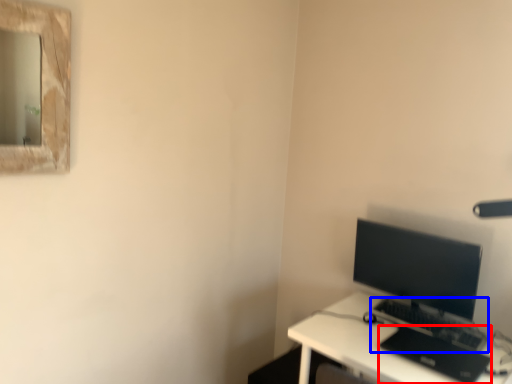
Question: Which of the following is the closest to the observer, laptop (highlighted by a red box) or computer keyboard (highlighted by a blue box)?

Choices:
 (A) laptop
 (B) computer keyboard

Answer: (A)